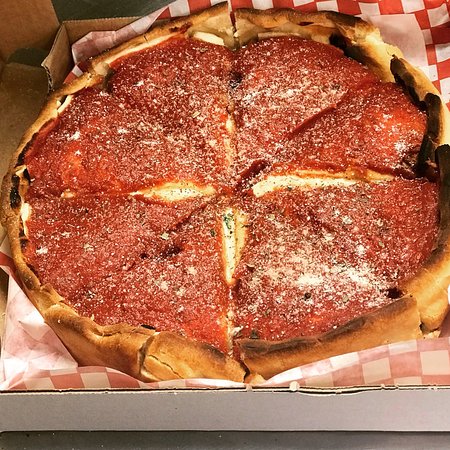
You are a GUI agent. You are given a task and a screenshot of the screen. Output one action in this format:
    pyautogui.click(x=<x>, y=<y>)
    Task: Click on the inside of pizza box
    This screenshot has width=450, height=450.
    Given the screenshot: What is the action you would take?
    pyautogui.click(x=17, y=101), pyautogui.click(x=62, y=59), pyautogui.click(x=20, y=25)